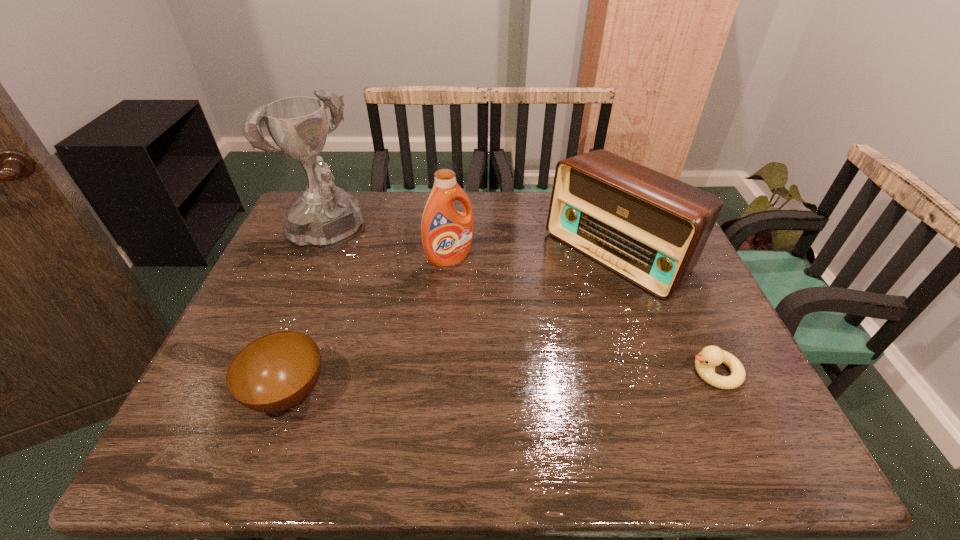
This screenshot has width=960, height=540. Find the location of `blank area located 0.210m on the front-facing side of the detergent`. blank area located 0.210m on the front-facing side of the detergent is located at coordinates (502, 314).

Identify the location of free location located 0.160m on the front-facing side of the detergent. (492, 302).

Identify the location of free space located on the front-facing side of the detergent. (490, 300).

I want to click on vacant space located 0.140m on the side with emblem of the tallest object, so click(x=370, y=282).

Find the location of a particular element. The image size is (960, 540). vacant area situated 0.380m on the side with emblem of the tallest object is located at coordinates (423, 331).

The height and width of the screenshot is (540, 960). Find the location of `free region located on the side with emblem of the tallest object`. free region located on the side with emblem of the tallest object is located at coordinates (396, 307).

I want to click on vacant space situated 0.270m on the front-facing side of the radio receiver, so click(506, 339).

Identify the location of free space located on the front-facing side of the radio receiver. (531, 320).

The width and height of the screenshot is (960, 540). Find the location of `free space located on the front-facing side of the radio receiver`. free space located on the front-facing side of the radio receiver is located at coordinates (500, 343).

Identify the location of award situated at the far edge. (326, 216).